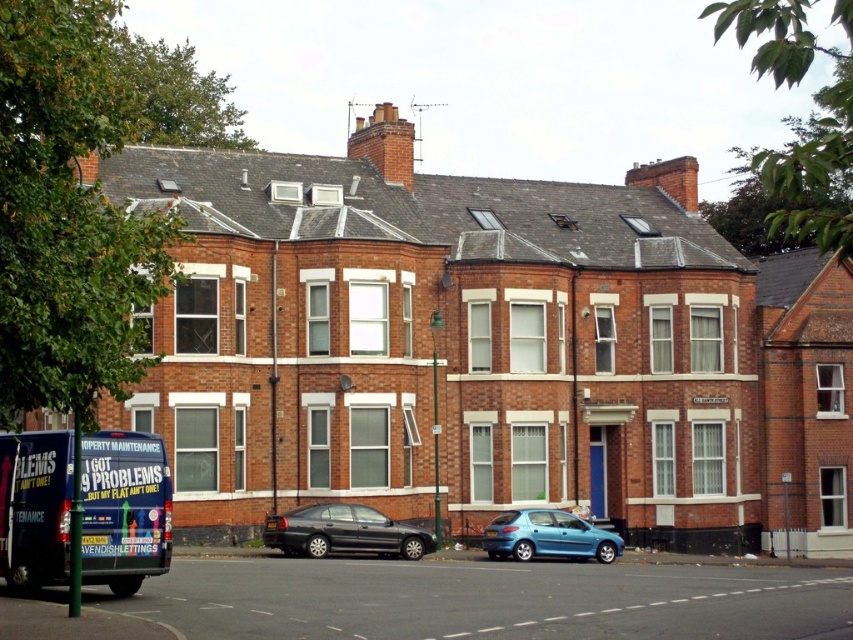
You are a delivery person trying to park your 1.8 meters tall delivery cart between the shiny black sedan at lower center and the metallic blue hatchback at center. Can your cart fit vertically between them?

The shiny black sedan at lower center is taller than the metallic blue hatchback at center. Since the delivery cart is 1.8 meters tall, it should fit vertically between them as long as the space between the cars is at least 1.8 meters in height.

You are driving a delivery van that is 5 meters long and need to park between the shiny black sedan at lower center and the metallic blue hatchback at center. Is there enough space between them for your van?

The distance between the shiny black sedan at lower center and the metallic blue hatchback at center is 4.91 meters. Since your van is 5 meters long, there is not enough space to park between them.

You are a delivery person needing to park your van between the shiny black sedan at lower center and the metallic blue hatchback at center. Which vehicle should you park next to if you want to minimize the space needed?

You should park next to the shiny black sedan at lower center because it has a smaller size compared to the metallic blue hatchback at center, so there will be less space required between them.